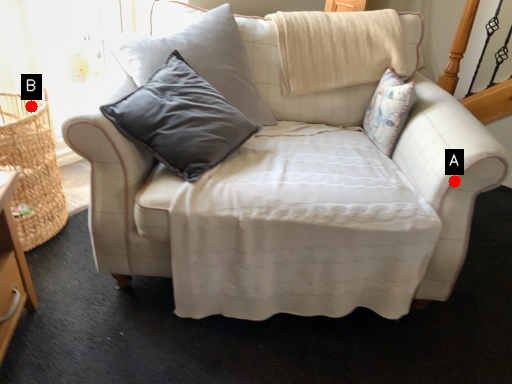
Question: Two points are circled on the image, labeled by A and B beside each circle. Among these points, which one is farthest from the camera?

Choices:
 (A) A is further
 (B) B is further

Answer: (B)